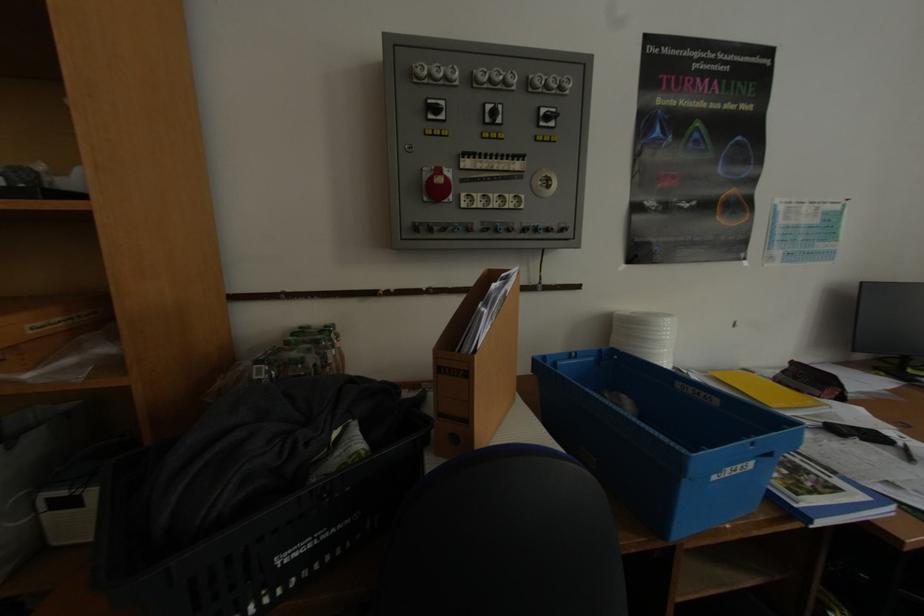
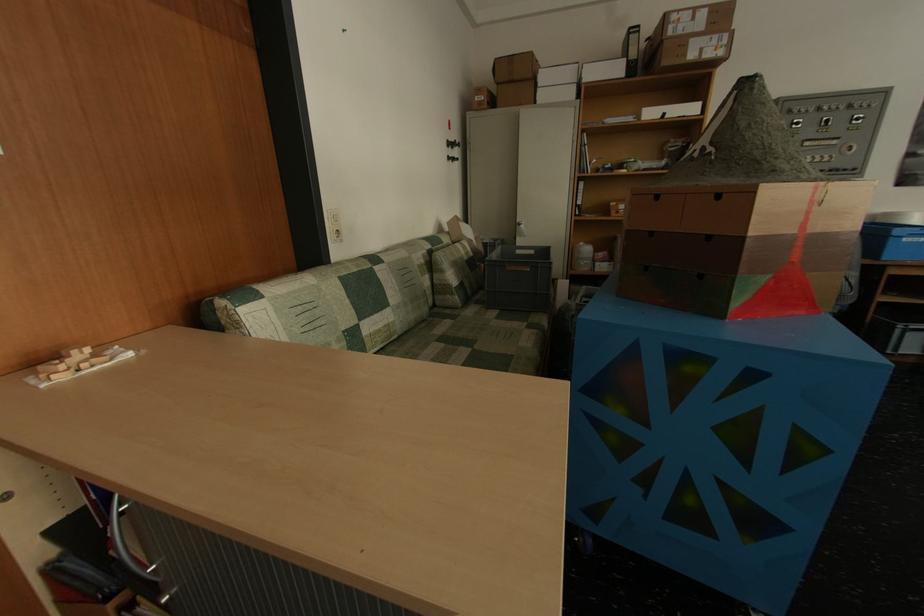
Consider the image. The images are taken continuously from a first-person perspective. In which direction are you moving?

The cameraman moved toward left, backward.